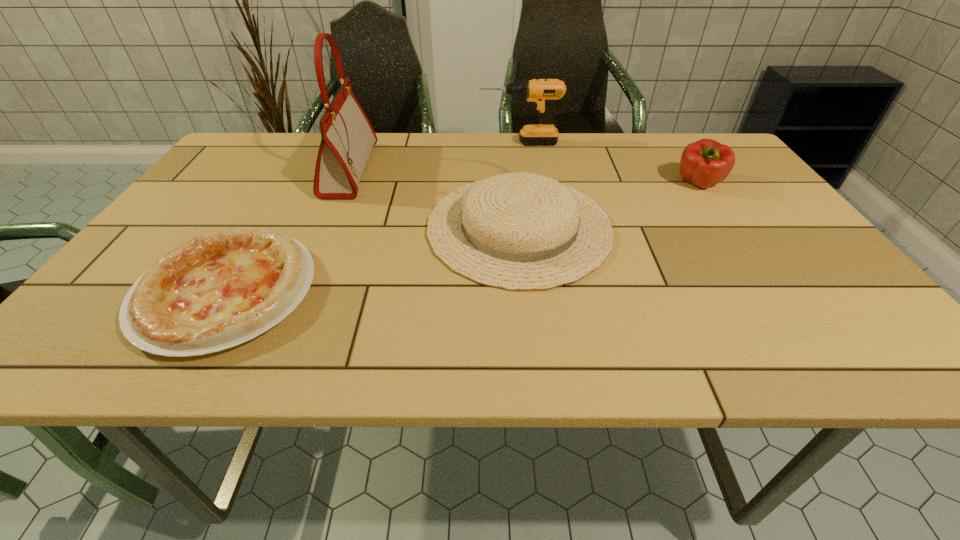
This screenshot has width=960, height=540. Find the location of `handbag`. handbag is located at coordinates (347, 138).

You are a GUI agent. You are given a task and a screenshot of the screen. Output one action in this format:
    pyautogui.click(x=<x>, y=<y>)
    Task: Click on the second tallest object
    This screenshot has width=960, height=540.
    Given the screenshot: What is the action you would take?
    pyautogui.click(x=541, y=92)

Identify the location of bell pepper. This screenshot has height=540, width=960. (706, 162).

Find the location of a particular element. Image resolution: width=960 pixels, height=540 pixels. the rightmost object is located at coordinates (706, 162).

You are a GUI agent. You are given a task and a screenshot of the screen. Output one action in this format:
    pyautogui.click(x=<x>, y=<y>)
    Task: Click on the sunhat
    
    Given the screenshot: What is the action you would take?
    pyautogui.click(x=518, y=231)

I want to click on pizza, so click(x=220, y=289).

Find the location of `free location located on the front of the handbag`. free location located on the front of the handbag is located at coordinates (315, 251).

Find the location of a particular element. blank space located 0.060m at the tip of the fourth shortest object is located at coordinates (459, 143).

The image size is (960, 540). In order to click on vacant area located 0.050m at the tip of the fourth shortest object in this screenshot , I will do `click(463, 143)`.

Identify the location of free space located 0.260m at the tip of the fourth shortest object. The height and width of the screenshot is (540, 960). (393, 143).